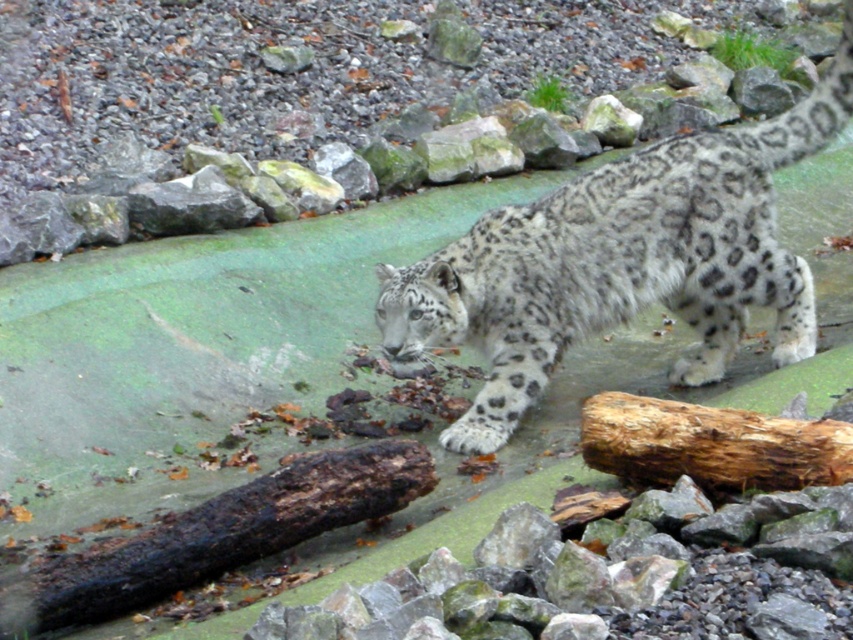
Does point (331, 476) come in front of point (671, 424)?

No, it is behind (671, 424).

Between charcoal-brown wood at lower left and rough brown log at lower right, which one appears on the left side from the viewer's perspective?

charcoal-brown wood at lower left is more to the left.

Identify the location of charcoal-brown wood at lower left. (218, 536).

Can you confirm if snowy fur snow leopard at center is positioned below charcoal-brown wood at lower left?

Actually, snowy fur snow leopard at center is above charcoal-brown wood at lower left.

Measure the distance from snowy fur snow leopard at center to charcoal-brown wood at lower left.

snowy fur snow leopard at center and charcoal-brown wood at lower left are 1.59 meters apart.

Is point (628, 276) more distant than point (218, 506)?

Yes, point (628, 276) is farther from viewer.

Find the location of `snowy fur snow leopard at center`. snowy fur snow leopard at center is located at coordinates (621, 260).

Based on the photo, between snowy fur snow leopard at center and rough brown log at lower right, which one is positioned lower?

rough brown log at lower right

Is snowy fur snow leopard at center to the right of rough brown log at lower right from the viewer's perspective?

Yes, snowy fur snow leopard at center is to the right of rough brown log at lower right.

Where is `snowy fur snow leopard at center`? This screenshot has width=853, height=640. snowy fur snow leopard at center is located at coordinates (621, 260).